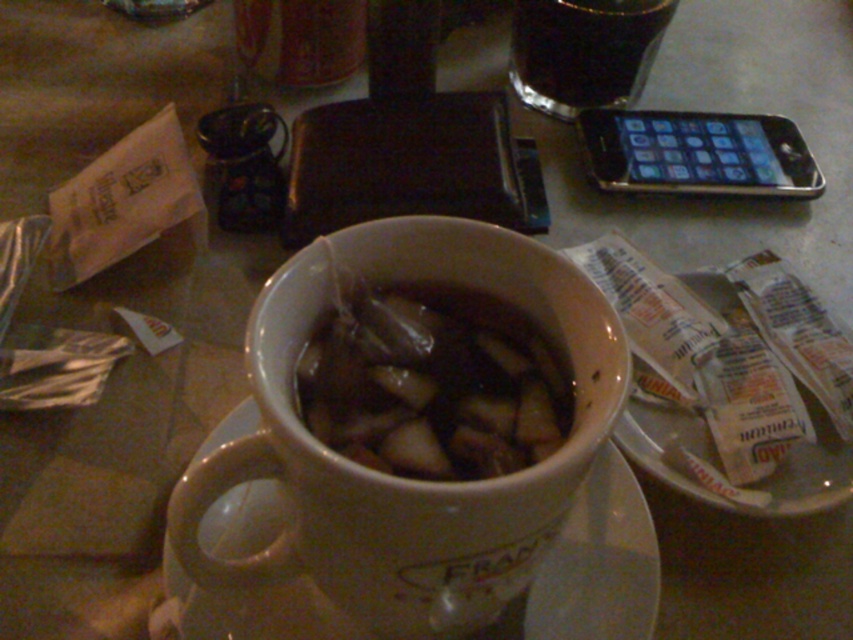
You are a customer at a coffee shop and see the translucent plastic bag at center and the black metallic smartphone at upper right on the table. Which item is closer to the left edge of the table?

The translucent plastic bag at center is closer to the left edge of the table because it is positioned to the left of the black metallic smartphone at upper right.

You are a customer at a cafe and want to check your phone. Where is the black metallic smartphone at upper right relative to the ceramic mug?

The black metallic smartphone at upper right is located at point (697, 154) relative to the ceramic mug.